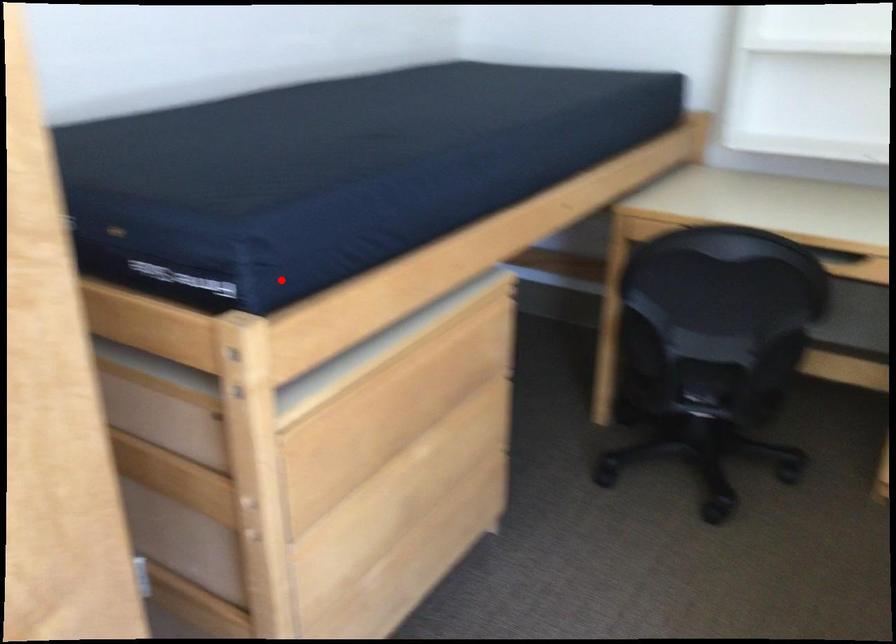
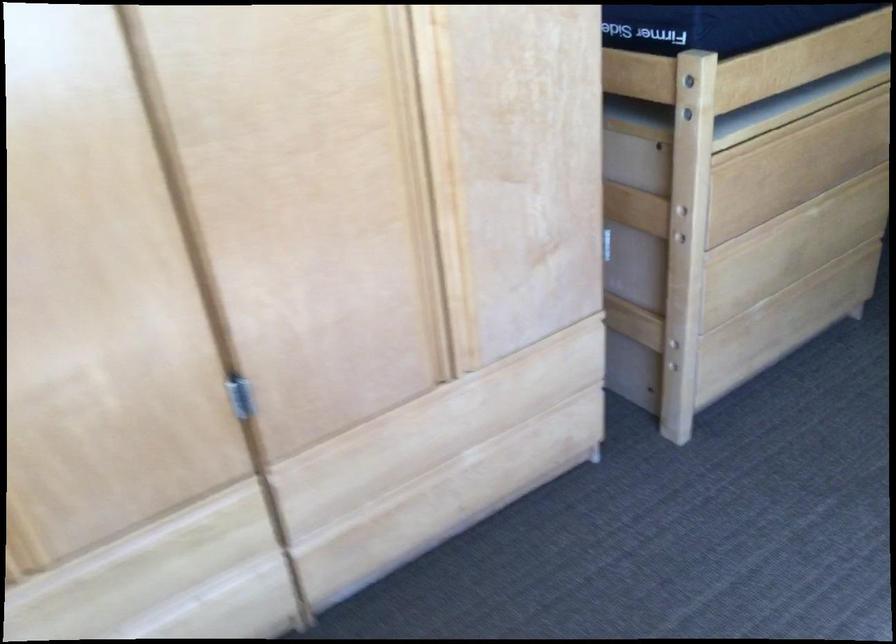
Where in the second image is the point corresponding to the highlighted location from the first image?

(718, 24)